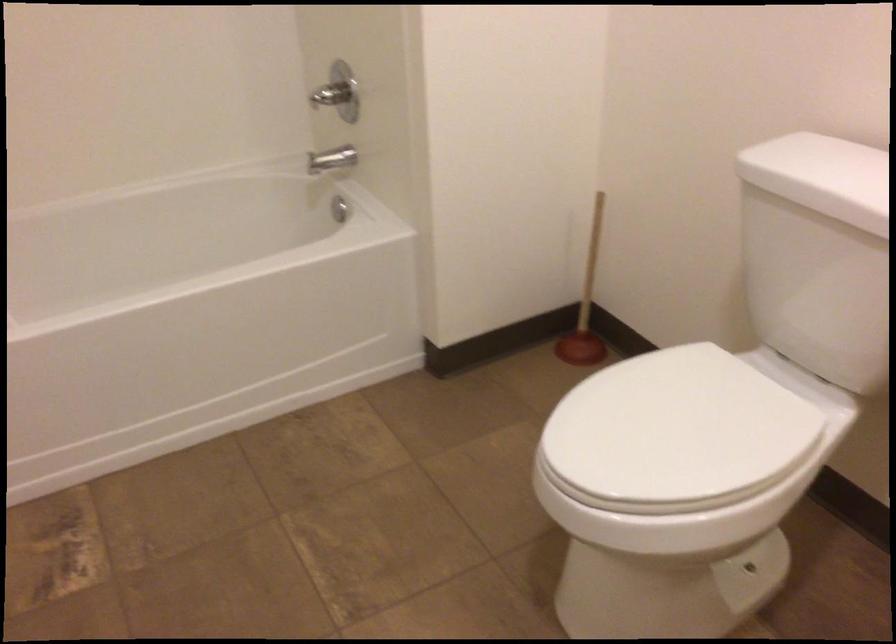
Where would you turn the chrome shower handle? Please return your answer as a coordinate pair (x, y).

(332, 93)